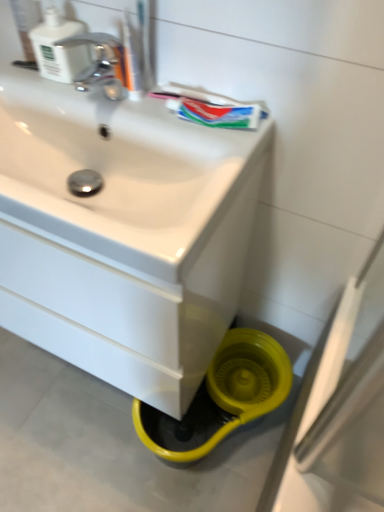
At what (x,y) coordinates should I click in order to perform the action: click on free space in front of translucent plastic toothbrush at upper center. Please return your answer as a coordinate pair (x, y). The height and width of the screenshot is (512, 384). Looking at the image, I should click on (167, 123).